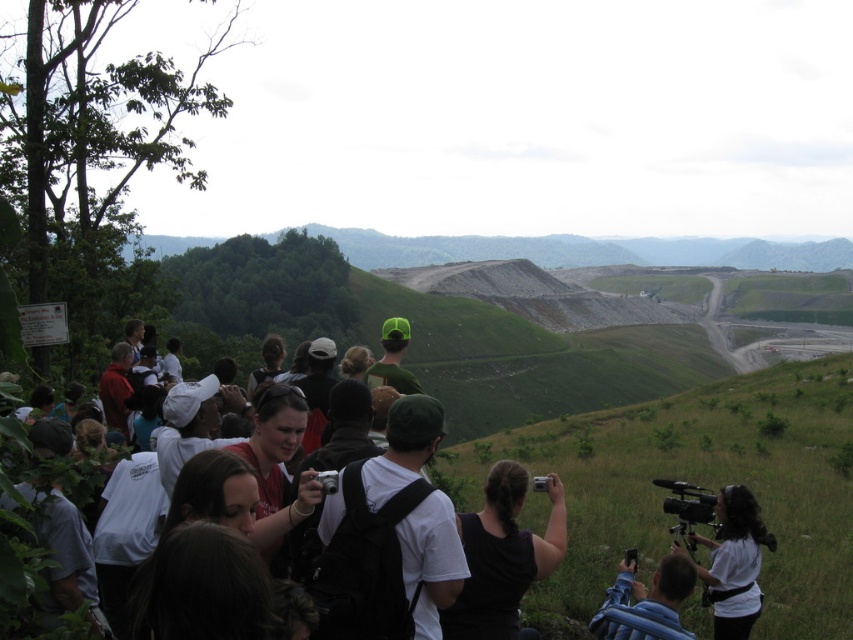
Question: Considering the relative positions of white matte backpack at center and blue fabric backpack at lower center in the image provided, where is white matte backpack at center located with respect to blue fabric backpack at lower center?

Choices:
 (A) left
 (B) right

Answer: (A)

Question: Does white matte camera at lower right have a greater width compared to blue fabric backpack at lower center?

Choices:
 (A) yes
 (B) no

Answer: (A)

Question: Which is farther from the white matte camera at lower right?

Choices:
 (A) blue fabric backpack at lower center
 (B) white matte backpack at center
 (C) black fabric camera at center

Answer: (B)

Question: Is black fabric camera at center above blue fabric backpack at lower center?

Choices:
 (A) yes
 (B) no

Answer: (A)

Question: Which object is closer to the camera taking this photo?

Choices:
 (A) white matte backpack at center
 (B) black fabric camera at center

Answer: (A)

Question: Which point is farther to the camera?

Choices:
 (A) (457, 630)
 (B) (416, 500)

Answer: (A)